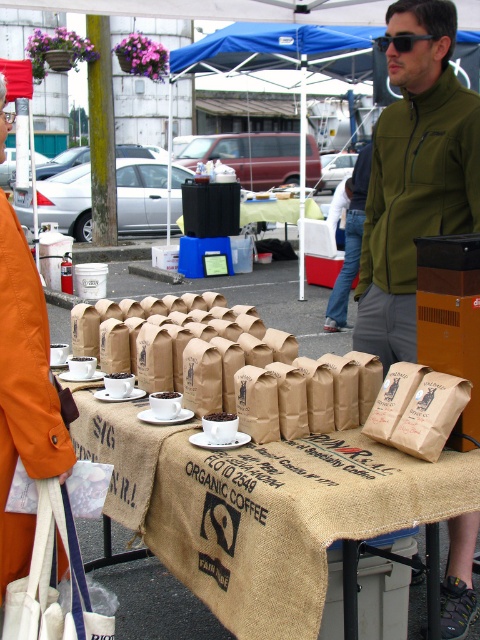
Question: Can you confirm if brown paper bag at center is positioned to the left of matte brown coffee cup at center?

Choices:
 (A) yes
 (B) no

Answer: (B)

Question: Which point is farther to the camera?

Choices:
 (A) brown paper bag at center
 (B) green fleece jacket at center
 (C) black plastic sunglasses at upper center

Answer: (C)

Question: Does orange fabric bag at lower left have a smaller size compared to black plastic sunglasses at upper center?

Choices:
 (A) no
 (B) yes

Answer: (A)

Question: Is burlap tablecloth at center bigger than black plastic sunglasses at upper center?

Choices:
 (A) no
 (B) yes

Answer: (B)

Question: Which point is farther to the camera?

Choices:
 (A) (223, 420)
 (B) (372, 324)
 (C) (384, 38)

Answer: (B)

Question: Which point appears closest to the camera in this image?

Choices:
 (A) (168, 397)
 (B) (48, 429)
 (C) (224, 417)

Answer: (B)